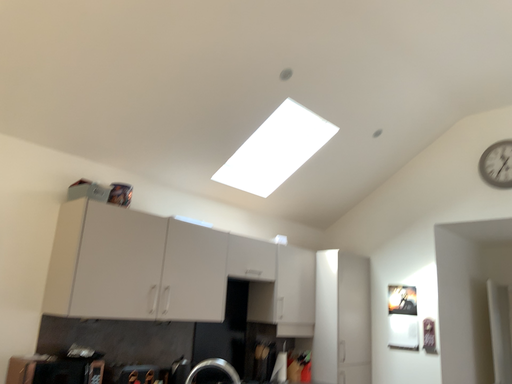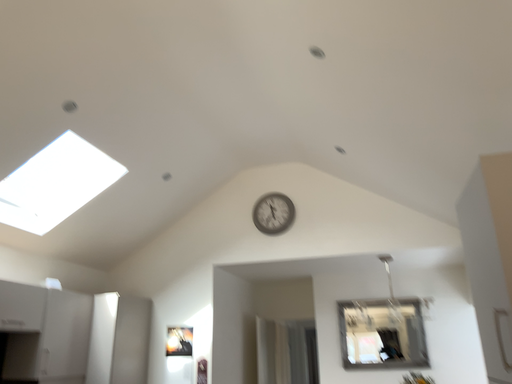
Question: Which way did the camera rotate in the video?

Choices:
 (A) rotated right
 (B) rotated left

Answer: (A)